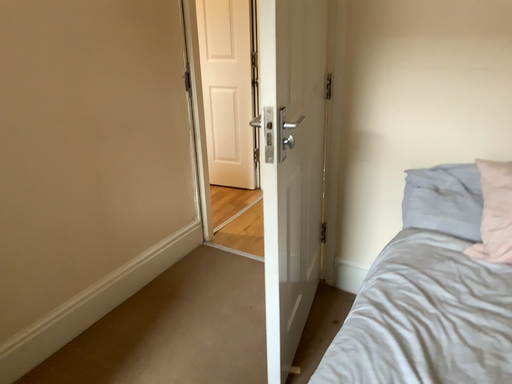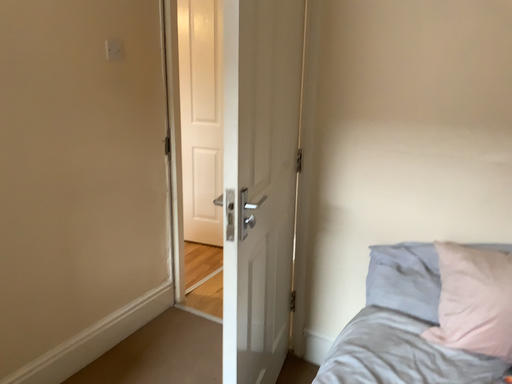
Question: How did the camera likely rotate when shooting the video?

Choices:
 (A) rotated upward
 (B) rotated downward

Answer: (A)